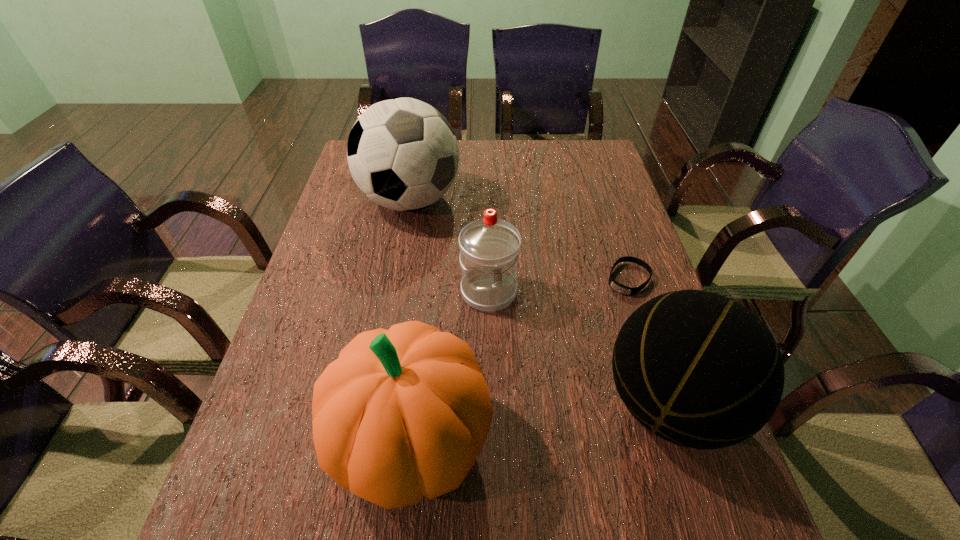
Where is `pumpkin`? Image resolution: width=960 pixels, height=540 pixels. pumpkin is located at coordinates (402, 413).

Image resolution: width=960 pixels, height=540 pixels. Find the location of `basketball`. basketball is located at coordinates (701, 371).

Locate an element on the screen. wristband is located at coordinates (629, 291).

The width and height of the screenshot is (960, 540). I want to click on the farthest object, so click(402, 153).

The width and height of the screenshot is (960, 540). I want to click on water bottle, so click(489, 247).

This screenshot has height=540, width=960. Find the location of `vacant point located on the right of the pumpkin`. vacant point located on the right of the pumpkin is located at coordinates (533, 440).

The width and height of the screenshot is (960, 540). Find the location of `vacant space located 0.260m on the left of the basketball`. vacant space located 0.260m on the left of the basketball is located at coordinates (473, 404).

Identify the location of vacant area located 0.370m on the display of the shortest object. (543, 400).

Where is `blank space located 0.250m on the display of the shortest object`? blank space located 0.250m on the display of the shortest object is located at coordinates (572, 360).

Find the location of a particular element. vacant position located 0.390m on the display of the shortest object is located at coordinates (539, 407).